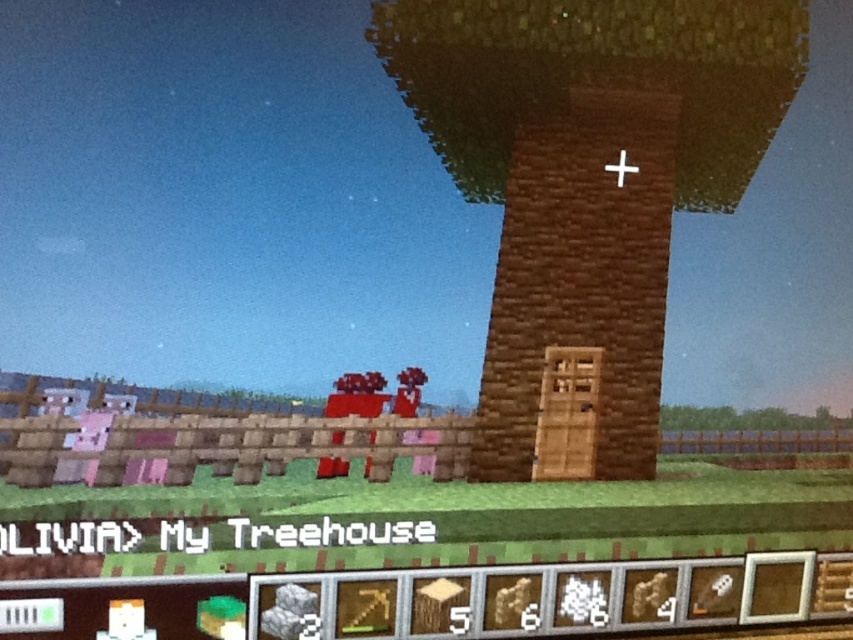
You are a player in Minecraft who wants to build a new structure next to the brown wooden tower at center and the white wooden cross at upper center. Since you want to ensure the new structure is balanced, you need to know which of the two existing structures is wider. Which one is wider?

The brown wooden tower at center is wider than the white wooden cross at upper center.

In the scene shown: You are navigating a Minecraft world and need to place a torch on the brown wooden tower at center. According to the coordinates provided, where should you place the torch?

The brown wooden tower at center is located at point (x=589, y=173), so you should place the torch there.